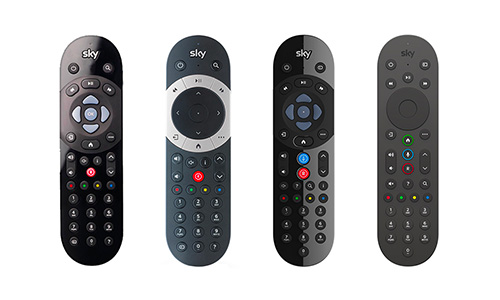
In order to click on remote controls in this screenshot , I will do `click(96, 45)`, `click(190, 50)`, `click(297, 47)`, `click(399, 44)`.